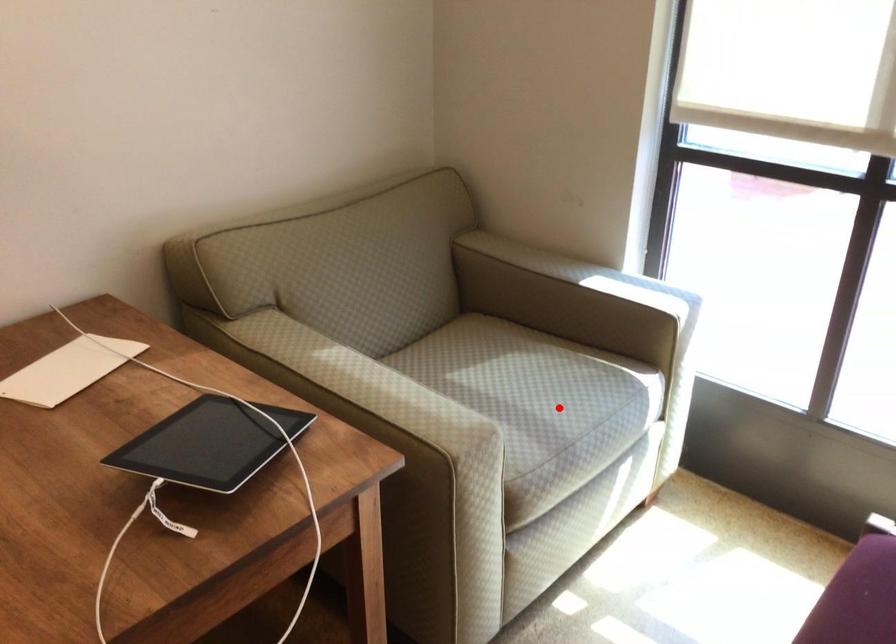
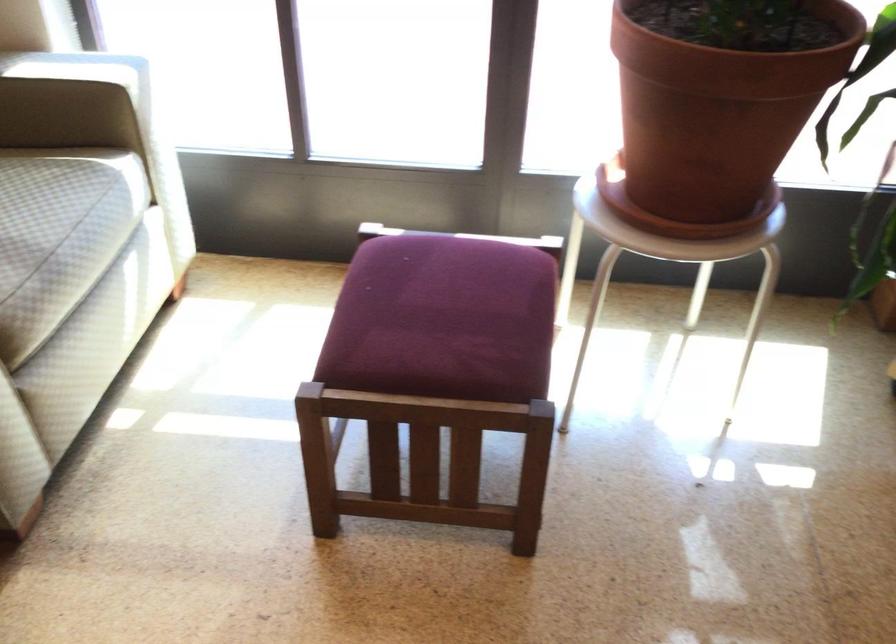
Question: I am providing you with two images of the same scene from different viewpoints. Image1 has a red point marked. In image2, the corresponding 3D location appears at what relative position? Reply with the corresponding letter.

Choices:
 (A) Closer
 (B) Farther

Answer: (A)